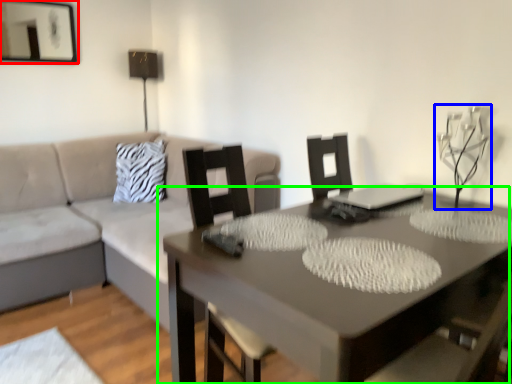
Question: Based on their relative distances, which object is farther from picture frame (highlighted by a red box)? Choose from candle holder (highlighted by a blue box) and table (highlighted by a green box).

Choices:
 (A) candle holder
 (B) table

Answer: (A)